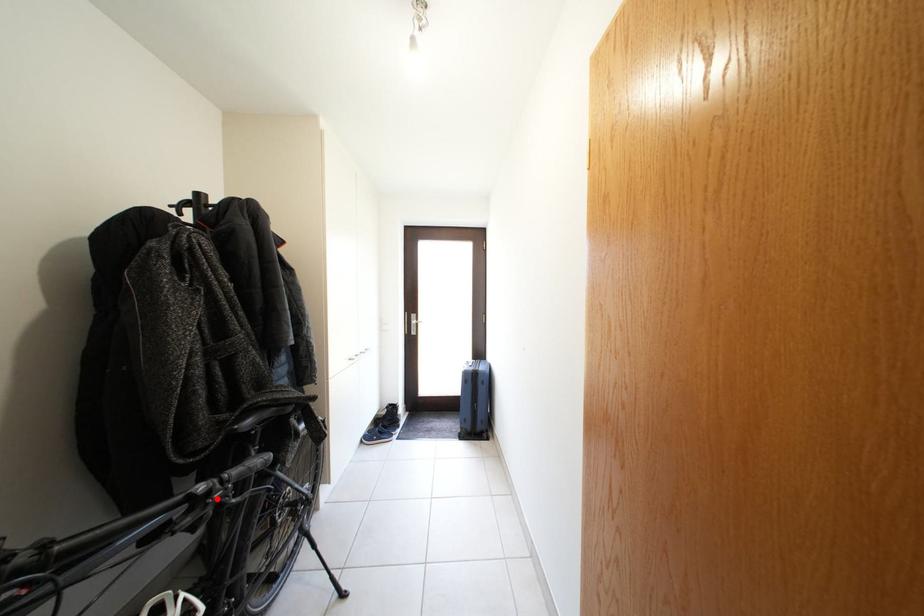
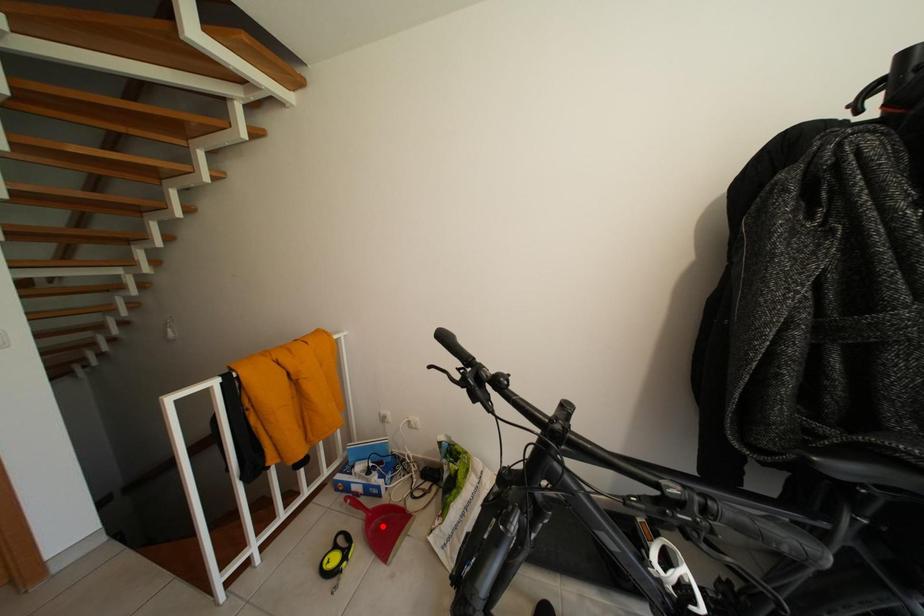
I am providing you with two images of the same scene from different viewpoints. A red point is marked on the first image and another point is marked on the second image. Is the marked point in image1 the same physical position as the marked point in image2?

No